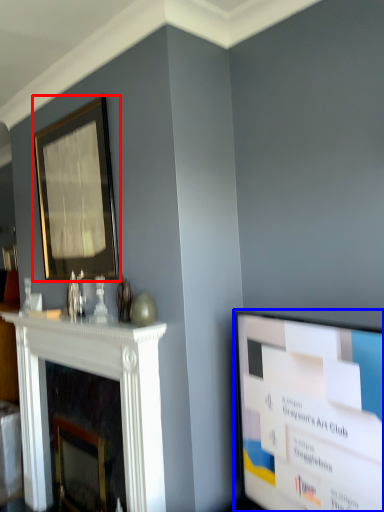
Question: Among these objects, which one is nearest to the camera, picture frame (highlighted by a red box) or television (highlighted by a blue box)?

Choices:
 (A) picture frame
 (B) television

Answer: (B)